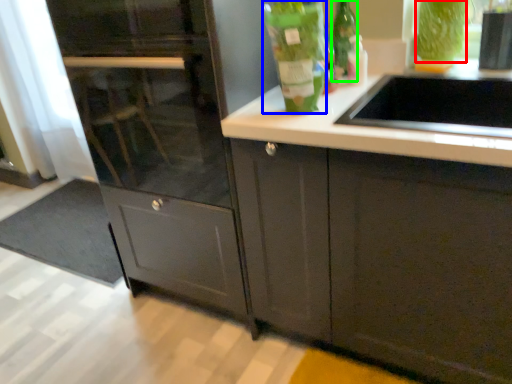
Question: Estimate the real-world distances between objects in this image. Which object is closer to drink (highlighted by a red box), bottle (highlighted by a blue box) or glass bottle (highlighted by a green box)?

Choices:
 (A) bottle
 (B) glass bottle

Answer: (B)